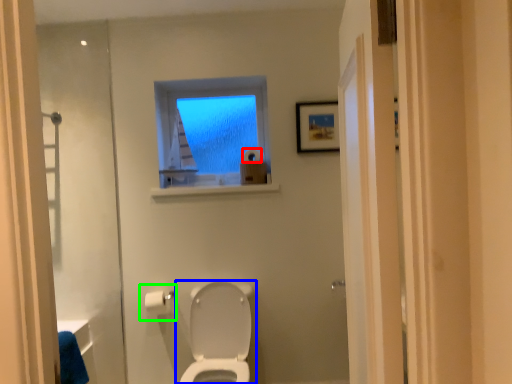
Question: Which object is positioned farthest from toilet paper (highlighted by a red box)? Select from toilet (highlighted by a blue box) and toilet paper (highlighted by a green box).

Choices:
 (A) toilet
 (B) toilet paper

Answer: (A)